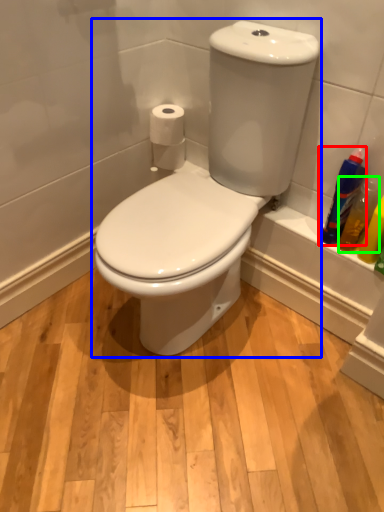
Question: Based on their relative distances, which object is nearer to cleaning product (highlighted by a red box)? Choose from toilet (highlighted by a blue box) and cleaning product (highlighted by a green box).

Choices:
 (A) toilet
 (B) cleaning product

Answer: (B)